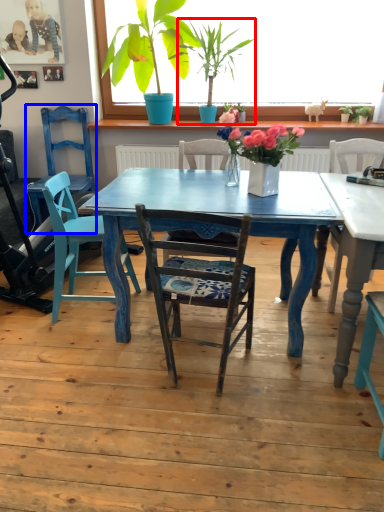
Question: Among these objects, which one is nearest to the camera, houseplant (highlighted by a red box) or armchair (highlighted by a blue box)?

Choices:
 (A) houseplant
 (B) armchair

Answer: (A)